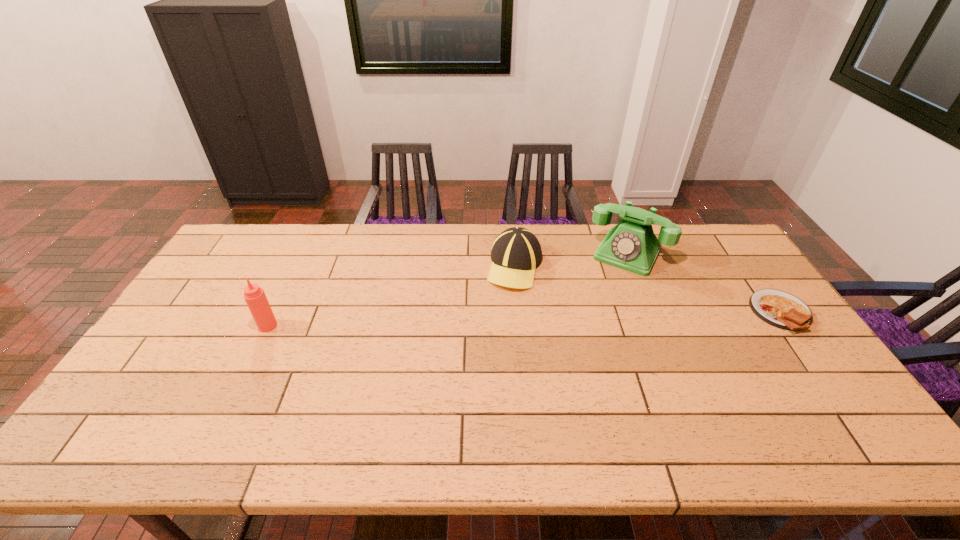
Locate an element on the screen. vacant position located 0.360m on the dial of the telephone is located at coordinates (576, 346).

This screenshot has width=960, height=540. In order to click on vacant space positioned with the brim of the second object from left to right facing forward in this screenshot , I will do `click(491, 313)`.

Where is `vacant space located with the brim of the second object from left to right facing forward`? Image resolution: width=960 pixels, height=540 pixels. vacant space located with the brim of the second object from left to right facing forward is located at coordinates (471, 343).

Find the location of a particular element. vacant space situated 0.380m with the brim of the second object from left to right facing forward is located at coordinates (448, 381).

Identify the location of telephone located at the far edge. The image size is (960, 540). (631, 245).

What are the coordinates of `baseball cap that is at the far edge` in the screenshot? It's located at (516, 253).

Find the location of a particular element. The width and height of the screenshot is (960, 540). object that is at the right edge is located at coordinates (780, 309).

Image resolution: width=960 pixels, height=540 pixels. In the image, there is a desktop. What are the coordinates of `blank space at the far edge` in the screenshot? It's located at (x=603, y=237).

Locate an element on the screen. The width and height of the screenshot is (960, 540). blank space at the near edge of the desktop is located at coordinates click(x=459, y=401).

Where is `free region at the left edge of the desktop`? free region at the left edge of the desktop is located at coordinates (184, 356).